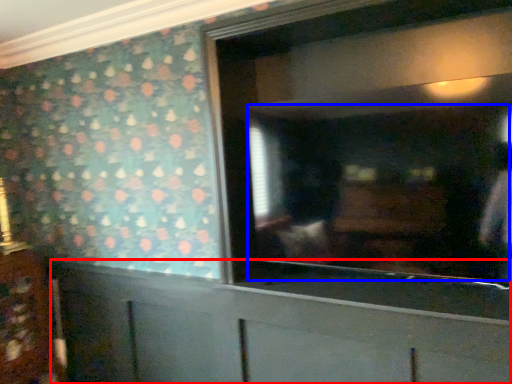
Question: Among these objects, which one is farthest to the camera, cabinetry (highlighted by a red box) or mirror (highlighted by a blue box)?

Choices:
 (A) cabinetry
 (B) mirror

Answer: (A)